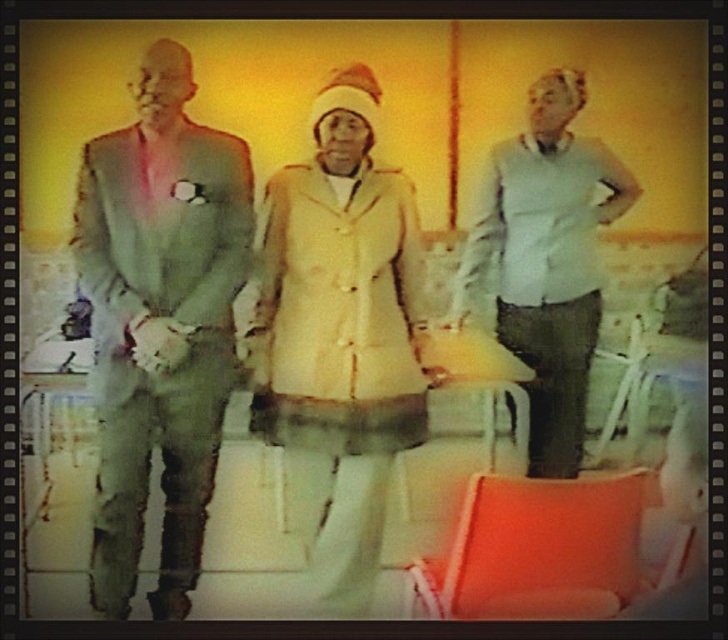
Question: Which point is farther to the camera?

Choices:
 (A) (178, 400)
 (B) (317, 141)

Answer: (A)

Question: Does matte gray suit at left lie behind light beige fabric coat at center?

Choices:
 (A) no
 (B) yes

Answer: (B)

Question: Is light beige fabric coat at center thinner than light blue sweater at center?

Choices:
 (A) yes
 (B) no

Answer: (A)

Question: Which object appears closest to the camera in this image?

Choices:
 (A) matte gray suit at left
 (B) light beige fabric coat at center
 (C) light blue sweater at center

Answer: (B)

Question: Where is matte gray suit at left located in relation to light blue sweater at center in the image?

Choices:
 (A) below
 (B) above

Answer: (A)

Question: Which is nearer to the light blue sweater at center?

Choices:
 (A) light beige fabric coat at center
 (B) matte gray suit at left

Answer: (A)